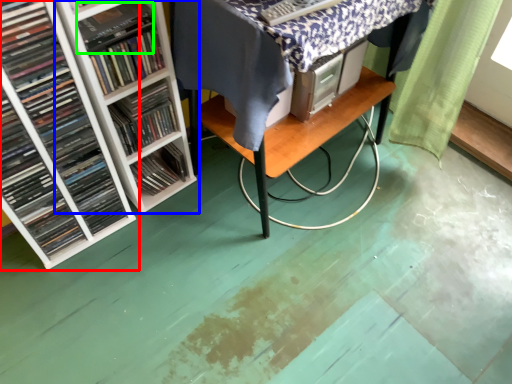
Question: Which object is the closest to the book (highlighted by a red box)? Choose among these: shelf (highlighted by a blue box) or paperback book (highlighted by a green box).

Choices:
 (A) shelf
 (B) paperback book

Answer: (A)